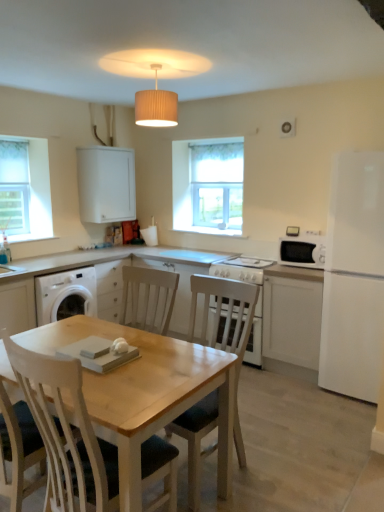
Question: Is white matte cabinet at right, which is the second cabinetry from top to bottom, inside or outside of white glass window at center?

Choices:
 (A) inside
 (B) outside

Answer: (B)

Question: Considering the positions of white matte cabinet at right, which is the second cabinetry from top to bottom, and white glass window at center in the image, is white matte cabinet at right, which is the second cabinetry from top to bottom, wider or thinner than white glass window at center?

Choices:
 (A) wide
 (B) thin

Answer: (A)

Question: Which of these objects is positioned farthest from the beige pleated shade at upper center?

Choices:
 (A) white glossy microwave oven at right
 (B) white glass window at center
 (C) white matte cabinet at upper left, acting as the 1th cabinetry starting from the left
 (D) white fabric window screen at left
 (E) white matte refrigerator at right

Answer: (D)

Question: Which object is the closest to the white matte cabinet at upper left, which is counted as the second cabinetry, starting from the bottom?

Choices:
 (A) light wood chair at center
 (B) white matte refrigerator at right
 (C) beige pleated shade at upper center
 (D) white glass window at center
 (E) white matte cabinet at right, which is the second cabinetry from top to bottom

Answer: (D)